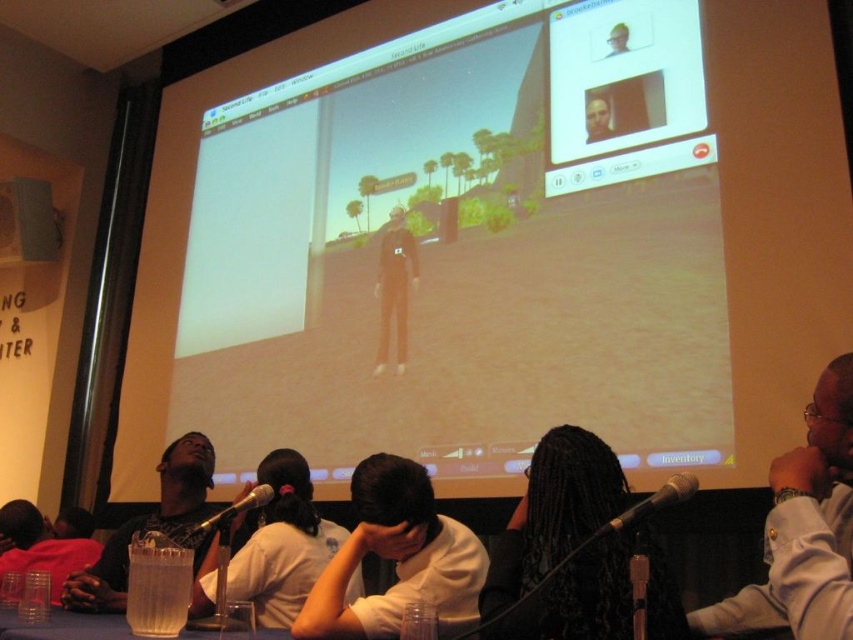
How much distance is there between matte black screen at center and metallic silver microphone at lower center?

The distance of matte black screen at center from metallic silver microphone at lower center is 6.07 feet.

Is point (816, 323) less distant than point (194, 534)?

No.

This screenshot has height=640, width=853. Find the location of `matte black screen at center`. matte black screen at center is located at coordinates (497, 241).

Is black hair at center thinner than white matte shirt at lower right?

Incorrect, black hair at center's width is not less than white matte shirt at lower right's.

Where is `black hair at center`? Image resolution: width=853 pixels, height=640 pixels. black hair at center is located at coordinates (553, 513).

Which of these two, black matte microphone at center or metallic silver microphone at lower center, stands taller?

metallic silver microphone at lower center

Is black matte microphone at center positioned at the back of metallic silver microphone at lower center?

No, it is in front of metallic silver microphone at lower center.

Locate an element on the screen. black matte microphone at center is located at coordinates (653, 502).